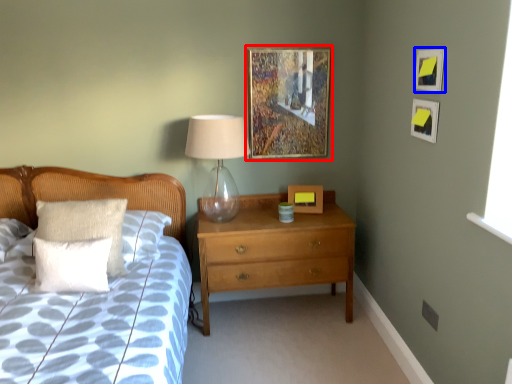
Question: Which point is further to the camera, picture frame (highlighted by a red box) or picture frame (highlighted by a blue box)?

Choices:
 (A) picture frame
 (B) picture frame

Answer: (A)